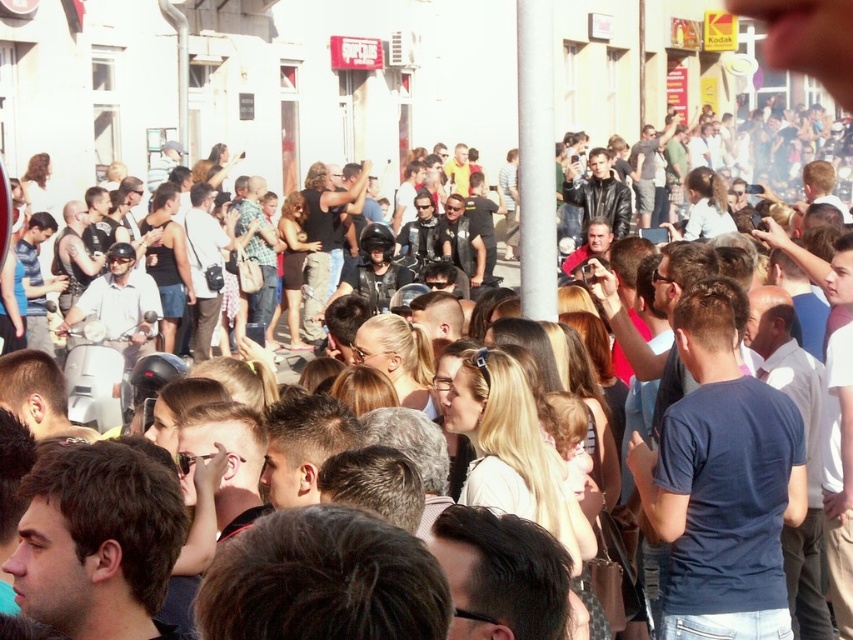
Question: Does dark blue t-shirt at center come in front of white glossy pole at center?

Choices:
 (A) yes
 (B) no

Answer: (A)

Question: Can you confirm if dark blue t-shirt at center is positioned to the right of white glossy pole at center?

Choices:
 (A) no
 (B) yes

Answer: (B)

Question: Which point appears farthest from the camera in this image?

Choices:
 (A) click(x=799, y=426)
 (B) click(x=550, y=266)

Answer: (B)

Question: Is dark blue t-shirt at center above white glossy pole at center?

Choices:
 (A) yes
 (B) no

Answer: (B)

Question: Which object is closer to the camera taking this photo?

Choices:
 (A) dark blue t-shirt at center
 (B) white glossy pole at center

Answer: (A)